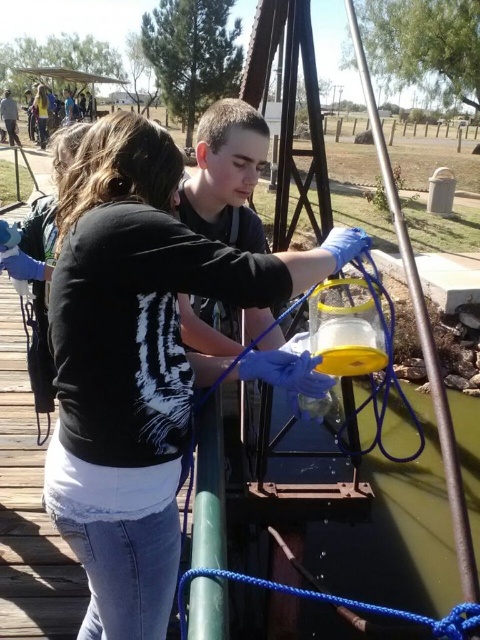
You are standing at the point with coordinates point (6, 90) and want to walk to the point with coordinates point (115, 166). Which direction should you move?

You should move forward because point (115, 166) is in front of point (6, 90).

You are standing at the origin point of the image. Which object is located at the coordinates point (139, 362)?

The matte black shirt at center is located at point (139, 362).

You are a park visitor trying to identify objects in the scene. Which object is bigger between the matte black shirt at center and the blue braided rope at lower center?

The matte black shirt at center is larger than the blue braided rope at lower center according to the description.